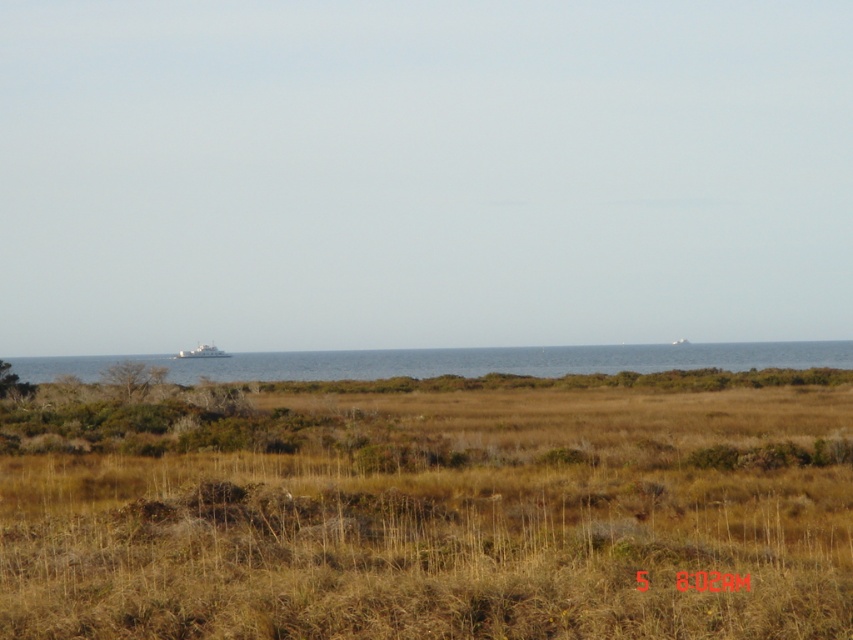
Question: Is brown dry grass at center in front of white matte boat at center?

Choices:
 (A) no
 (B) yes

Answer: (B)

Question: Among these objects, which one is farthest from the camera?

Choices:
 (A) brown dry grass at center
 (B) white matte boat at center
 (C) blue water at center

Answer: (B)

Question: Which object appears farthest from the camera in this image?

Choices:
 (A) brown dry grass at center
 (B) white matte boat at center
 (C) blue water at center

Answer: (B)

Question: Can you confirm if brown dry grass at center is positioned to the right of blue water at center?

Choices:
 (A) no
 (B) yes

Answer: (B)

Question: Which of the following is the farthest from the observer?

Choices:
 (A) (173, 355)
 (B) (80, 636)

Answer: (A)

Question: Can you confirm if brown dry grass at center is positioned to the left of white matte boat at center?

Choices:
 (A) no
 (B) yes

Answer: (A)